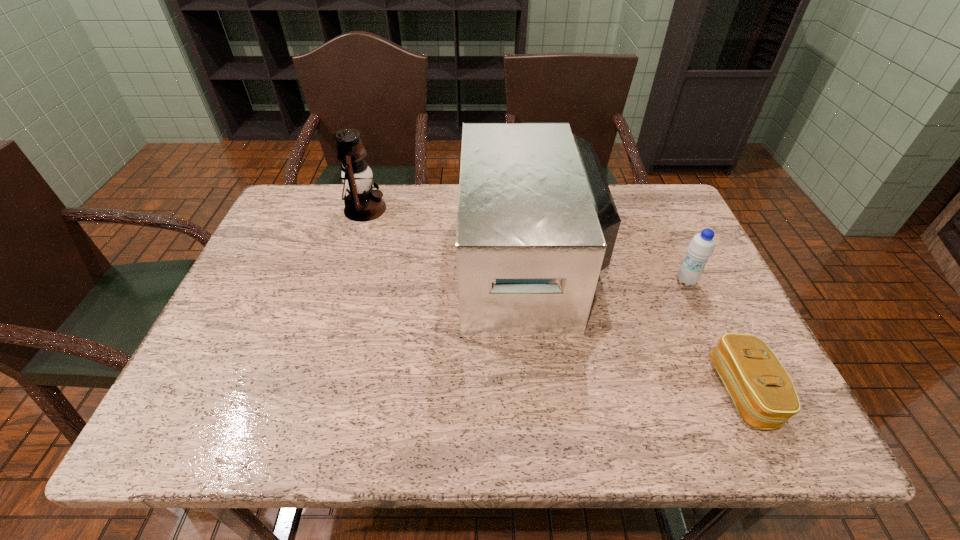
The image size is (960, 540). What are the coordinates of `vacant point that satisfies the following two spatial constraints: 1. on the side of the leftmost object, there is a wick adjustment knob; 2. on the back side of the third tallest object` in the screenshot? It's located at (343, 281).

Where is `vacant position in the image that satisfies the following two spatial constraints: 1. on the side of the water bottle, there is a wick adjustment knob; 2. on the left side of the leftmost object`? The height and width of the screenshot is (540, 960). vacant position in the image that satisfies the following two spatial constraints: 1. on the side of the water bottle, there is a wick adjustment knob; 2. on the left side of the leftmost object is located at coordinates pos(343,281).

Find the location of `free space that satisfies the following two spatial constraints: 1. on the side of the second shortest object, there is a wick adjustment knob; 2. on the left side of the leftmost object`. free space that satisfies the following two spatial constraints: 1. on the side of the second shortest object, there is a wick adjustment knob; 2. on the left side of the leftmost object is located at coordinates (343, 281).

Locate an element on the screen. This screenshot has width=960, height=540. vacant space that satisfies the following two spatial constraints: 1. on the side of the water bottle, there is a wick adjustment knob; 2. on the left side of the lantern is located at coordinates (343, 281).

Where is `free space that satisfies the following two spatial constraints: 1. on the side of the lantern, there is a wick adjustment knob; 2. on the right side of the second shortest object`? The width and height of the screenshot is (960, 540). free space that satisfies the following two spatial constraints: 1. on the side of the lantern, there is a wick adjustment knob; 2. on the right side of the second shortest object is located at coordinates tap(343, 281).

Where is `free spot that satisfies the following two spatial constraints: 1. on the back side of the water bottle; 2. on the side of the leftmost object, there is a wick adjustment knob`? Image resolution: width=960 pixels, height=540 pixels. free spot that satisfies the following two spatial constraints: 1. on the back side of the water bottle; 2. on the side of the leftmost object, there is a wick adjustment knob is located at coordinates (653, 209).

Identify the location of free point that satisfies the following two spatial constraints: 1. on the back side of the third tallest object; 2. on the side of the leftmost object, there is a wick adjustment knob. The image size is (960, 540). (653, 209).

The image size is (960, 540). Identify the location of vacant region that satisfies the following two spatial constraints: 1. on the back side of the water bottle; 2. on the side of the lantern, there is a wick adjustment knob. (653, 209).